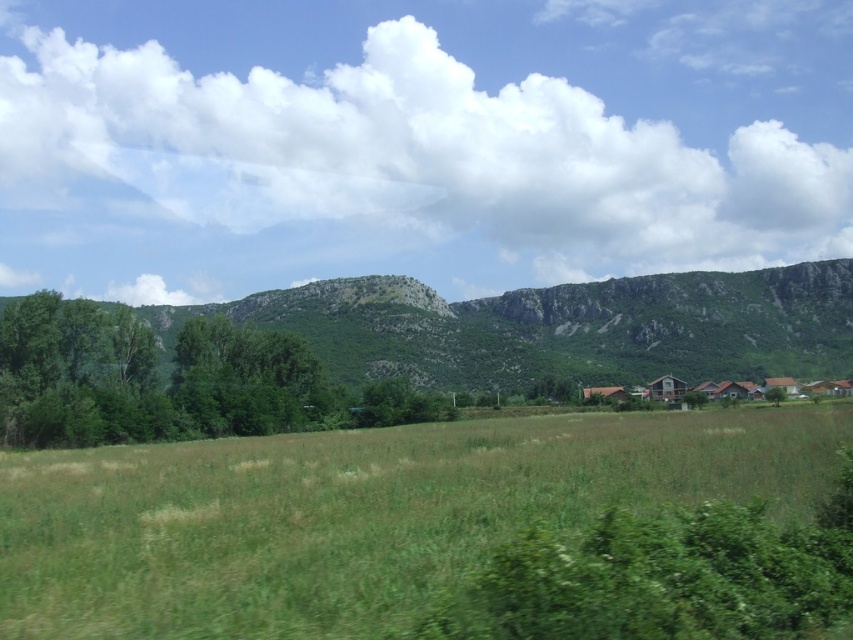
Question: Which object is the farthest from the green leafy tree at center-right?

Choices:
 (A) green rocky mountain at center
 (B) green grassy field at center

Answer: (A)

Question: Can you confirm if green grassy field at center is smaller than green rocky mountain at center?

Choices:
 (A) no
 (B) yes

Answer: (B)

Question: Which point is closer to the camera?

Choices:
 (A) (310, 451)
 (B) (782, 397)

Answer: (A)

Question: Does green rocky mountain at center lie in front of green leafy tree at center-right?

Choices:
 (A) no
 (B) yes

Answer: (B)

Question: Does green rocky mountain at center appear under green leafy tree at center-right?

Choices:
 (A) no
 (B) yes

Answer: (A)

Question: Considering the real-world distances, which object is closest to the green rocky mountain at center?

Choices:
 (A) green leafy tree at center-right
 (B) green grassy field at center

Answer: (A)